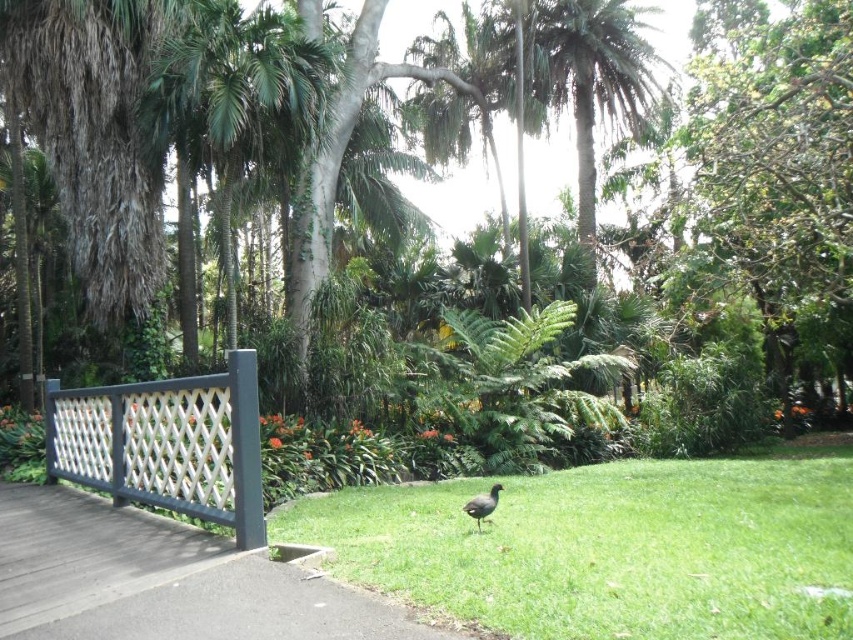
You are standing in the tropical garden and want to take a photo of the green grass at center and the white lattice fence at left. Which object should you focus on first if you want both to be in clear view?

Since the green grass at center is in front of the white lattice fence at left, you should focus on the green grass at center first to ensure both are in clear view.

Based on the photo, you are standing on the wooden walkway to the left and want to approach the brown matte bird at center without stepping on the green grass at center. Which direction should you move to reach the bird?

The green grass at center is positioned on the right side of brown matte bird at center, so you should move to the left to avoid stepping on the grass and reach the bird.

You are a gardener standing on the wooden walkway to the left. You see the green grass at center and the brown matte bird at center. Which object is closer to you, the gardener?

The brown matte bird at center is closer to you because it is above the green grass at center, which is located below it.